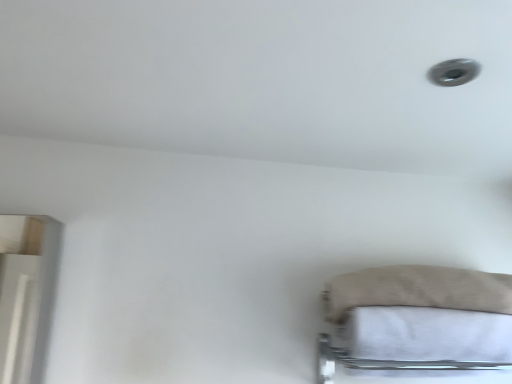
Describe the element at coordinates (418, 290) in the screenshot. I see `beige fabric pillow at lower right` at that location.

Locate an element on the screen. The height and width of the screenshot is (384, 512). beige fabric pillow at lower right is located at coordinates (418, 290).

The image size is (512, 384). What do you see at coordinates (426, 334) in the screenshot? I see `white cotton sheet at lower right` at bounding box center [426, 334].

The image size is (512, 384). Identify the location of white cotton sheet at lower right. pos(426,334).

What is the approximate width of white cotton sheet at lower right?

white cotton sheet at lower right is 9.44 inches in width.

Find the location of a particular element. beige fabric pillow at lower right is located at coordinates (418, 290).

Considering the relative positions of white cotton sheet at lower right and beige fabric pillow at lower right in the image provided, is white cotton sheet at lower right to the left of beige fabric pillow at lower right from the viewer's perspective?

In fact, white cotton sheet at lower right is to the right of beige fabric pillow at lower right.

Is white cotton sheet at lower right closer to camera compared to beige fabric pillow at lower right?

Yes.

Is point (499, 327) closer to viewer compared to point (353, 299)?

Yes, point (499, 327) is in front of point (353, 299).

From the image's perspective, between white cotton sheet at lower right and beige fabric pillow at lower right, who is located below?

white cotton sheet at lower right, from the image's perspective.

From a real-world perspective, is white cotton sheet at lower right physically located above or below beige fabric pillow at lower right?

From a real-world perspective, white cotton sheet at lower right is physically below beige fabric pillow at lower right.

Consider the image. Considering the relative sizes of white cotton sheet at lower right and beige fabric pillow at lower right in the image provided, is white cotton sheet at lower right wider than beige fabric pillow at lower right?

Yes, white cotton sheet at lower right is wider than beige fabric pillow at lower right.

Is white cotton sheet at lower right taller or shorter than beige fabric pillow at lower right?

In the image, white cotton sheet at lower right appears to be taller than beige fabric pillow at lower right.

Considering the sizes of objects white cotton sheet at lower right and beige fabric pillow at lower right in the image provided, who is bigger, white cotton sheet at lower right or beige fabric pillow at lower right?

With larger size is beige fabric pillow at lower right.

In the scene shown: Is beige fabric pillow at lower right located within white cotton sheet at lower right?

Definitely not — beige fabric pillow at lower right is not inside white cotton sheet at lower right.

Is white cotton sheet at lower right in contact with beige fabric pillow at lower right?

Yes, the surface of white cotton sheet at lower right is in contact with beige fabric pillow at lower right.

Could you tell me if white cotton sheet at lower right is facing beige fabric pillow at lower right?

No, white cotton sheet at lower right is not aimed at beige fabric pillow at lower right.

This screenshot has width=512, height=384. In order to click on sheet below the beige fabric pillow at lower right (from a real-world perspective) in this screenshot , I will do `click(426, 334)`.

Between beige fabric pillow at lower right and white cotton sheet at lower right, which one appears on the right side from the viewer's perspective?

white cotton sheet at lower right.

Considering their positions, is beige fabric pillow at lower right located in front of or behind white cotton sheet at lower right?

beige fabric pillow at lower right is positioned farther from the viewer than white cotton sheet at lower right.

Which is behind, point (486, 280) or point (426, 351)?

The point (486, 280) is farther.

From the image's perspective, which one is positioned lower, beige fabric pillow at lower right or white cotton sheet at lower right?

From the image's view, white cotton sheet at lower right is below.

From a real-world perspective, is beige fabric pillow at lower right physically located above or below white cotton sheet at lower right?

Clearly, from a real-world perspective, beige fabric pillow at lower right is above white cotton sheet at lower right.

Looking at their sizes, would you say beige fabric pillow at lower right is wider or thinner than white cotton sheet at lower right?

Clearly, beige fabric pillow at lower right has less width compared to white cotton sheet at lower right.

Which of these two, beige fabric pillow at lower right or white cotton sheet at lower right, stands taller?

white cotton sheet at lower right is taller.

Who is bigger, beige fabric pillow at lower right or white cotton sheet at lower right?

With larger size is beige fabric pillow at lower right.

Would you say white cotton sheet at lower right is part of beige fabric pillow at lower right's contents?

That's incorrect, white cotton sheet at lower right is not inside beige fabric pillow at lower right.

Is the surface of beige fabric pillow at lower right in direct contact with white cotton sheet at lower right?

Yes, beige fabric pillow at lower right is right next to white cotton sheet at lower right and making contact.

Is beige fabric pillow at lower right aimed at white cotton sheet at lower right?

No.

What's the angular difference between beige fabric pillow at lower right and white cotton sheet at lower right's facing directions?

The facing directions of beige fabric pillow at lower right and white cotton sheet at lower right are 0.00107 degrees apart.

At what (x,y) coordinates should I click in order to perform the action: click on sheet on the right of beige fabric pillow at lower right. Please return your answer as a coordinate pair (x, y). The width and height of the screenshot is (512, 384). Looking at the image, I should click on (426, 334).

In the image, there is a white cotton sheet at lower right. What are the coordinates of `pillow above it (from the image's perspective)` in the screenshot? It's located at tap(418, 290).

Where is `sheet below the beige fabric pillow at lower right (from a real-world perspective)`? The image size is (512, 384). sheet below the beige fabric pillow at lower right (from a real-world perspective) is located at coordinates (426, 334).